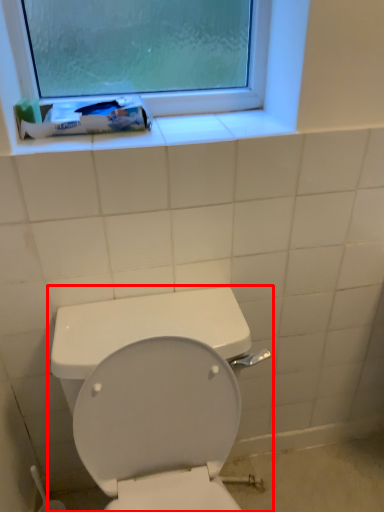
Question: From the image's perspective, where is toilet (annotated by the red box) located relative to toothpaste?

Choices:
 (A) above
 (B) below

Answer: (B)